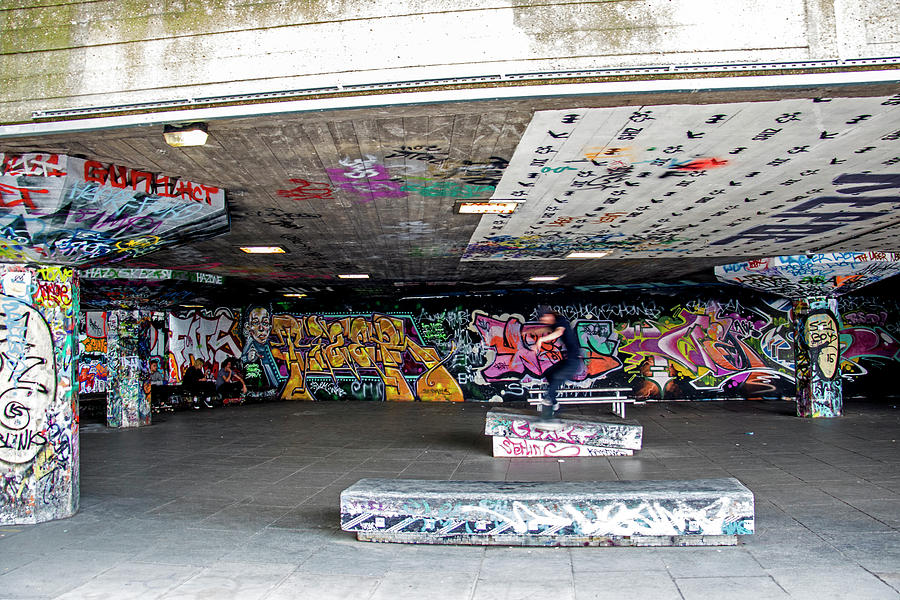
Where is `long bench in front`? The image size is (900, 600). long bench in front is located at coordinates (558, 513).